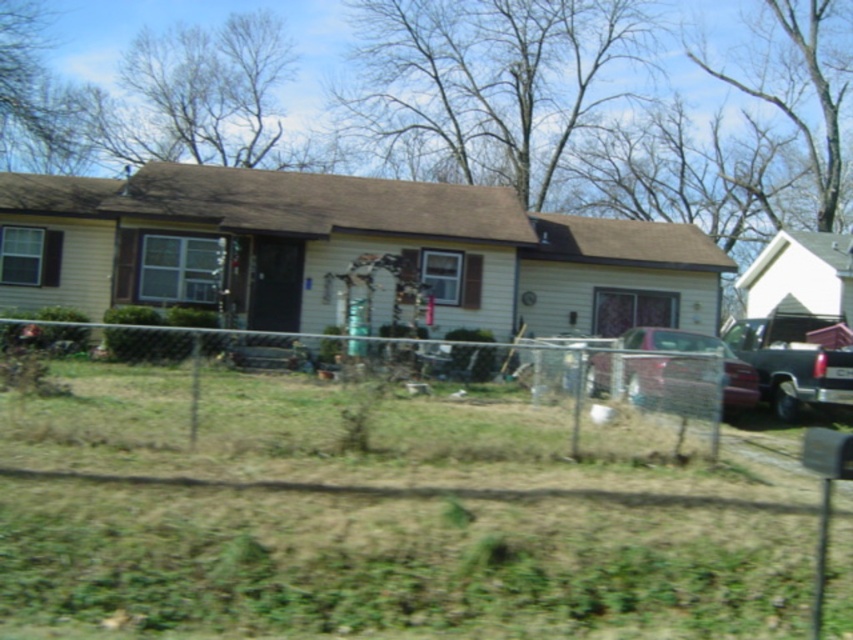
You are standing at the front door of the house and want to walk to the point marked by the coordinates (669, 381). Is there an unobstructed path from the front door to that point?

The point (669, 381) is on the metallic maroon sedan at center, so the path to it would be obstructed by the sedan itself, making it inaccessible from the front door.

You are a gardener who wants to mow the lawn. You see the green grass at lower center and the wire mesh fence at center. Which area is bigger in size?

The green grass at lower center has a larger size compared to the wire mesh fence at center, so the green grass at lower center is bigger in size.

You are a delivery person trying to access the driveway of the house. The driveway is behind the chain link fence. You see a metallic maroon sedan at center and a metallic dark gray truck at right. Which vehicle is blocking your path to the driveway?

The metallic maroon sedan at center is blocking the path to the driveway because it is positioned in front of the metallic dark gray truck at right, meaning it is closer to the driveway entrance.